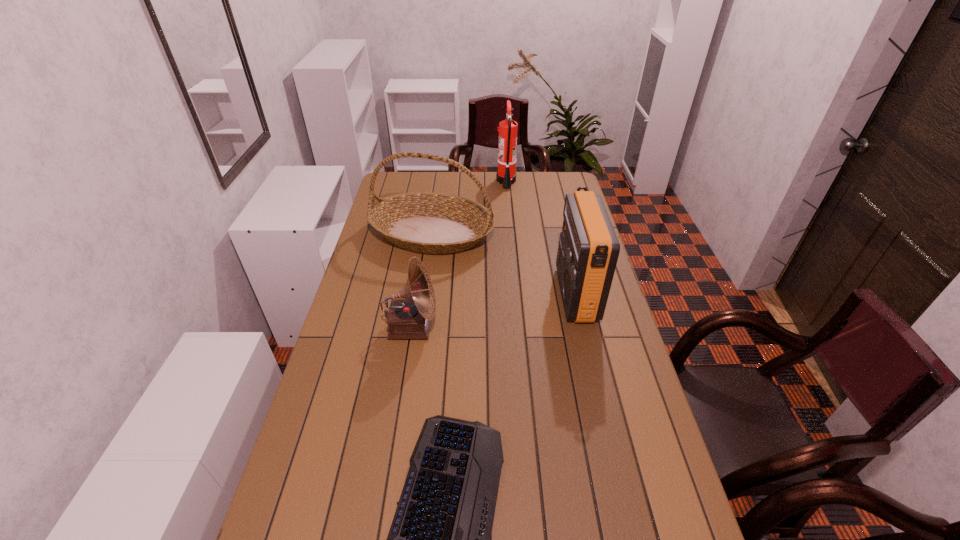
Where is `free spot between the rightmost object and the basket`? Image resolution: width=960 pixels, height=540 pixels. free spot between the rightmost object and the basket is located at coordinates (504, 264).

You are a GUI agent. You are given a task and a screenshot of the screen. Output one action in this format:
    pyautogui.click(x=<x>, y=<y>)
    Task: Click on the vacant area between the rightmost object and the second farthest object
    Image resolution: width=960 pixels, height=540 pixels.
    Given the screenshot: What is the action you would take?
    pyautogui.click(x=504, y=264)

At what (x,y) coordinates should I click in order to perform the action: click on free spot between the basket and the radio receiver. Please return your answer as a coordinate pair (x, y). Image resolution: width=960 pixels, height=540 pixels. Looking at the image, I should click on [x=504, y=264].

Locate an element on the screen. Image resolution: width=960 pixels, height=540 pixels. object that stands as the second closest to the fire extinguisher is located at coordinates (588, 250).

At what (x,y) coordinates should I click in order to perform the action: click on the third closest object to the rightmost object. Please return your answer as a coordinate pair (x, y). The height and width of the screenshot is (540, 960). Looking at the image, I should click on (409, 318).

The width and height of the screenshot is (960, 540). Find the location of `vacant area in the image that satisfies the following two spatial constraints: 1. on the front side of the basket; 2. on the horn of the phonograph record`. vacant area in the image that satisfies the following two spatial constraints: 1. on the front side of the basket; 2. on the horn of the phonograph record is located at coordinates (419, 328).